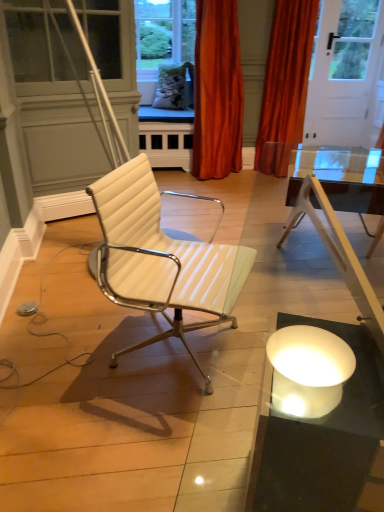
Find the location of a particular element. This screenshot has width=384, height=512. vacant point to the left of white leather chair at center is located at coordinates (75, 344).